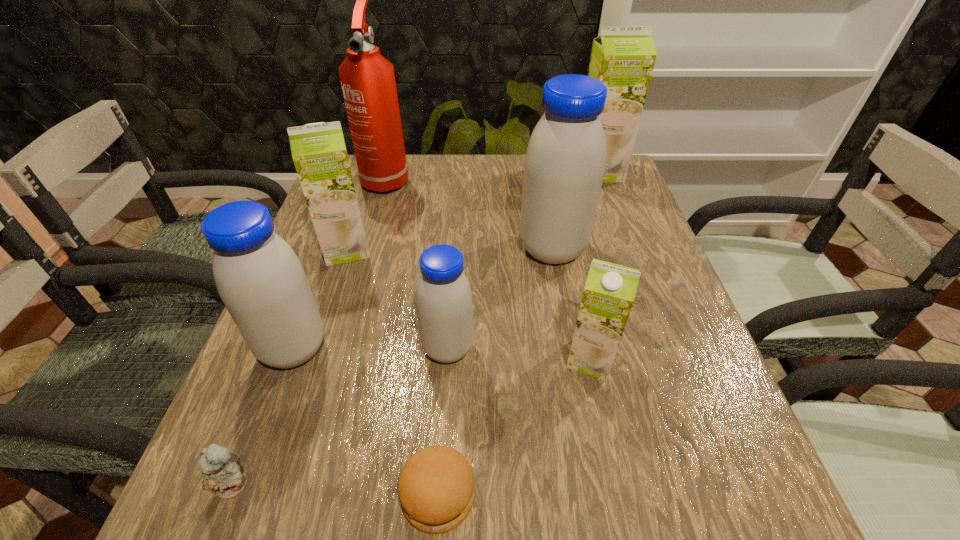
Locate an element on the screen. The image size is (960, 540). free space between the rightmost object and the red fire extinguisher is located at coordinates (492, 174).

What are the coordinates of `free space between the leftmost blue soya milk and the red fire extinguisher` in the screenshot? It's located at (340, 264).

Find the location of a particular element. This screenshot has width=960, height=540. free spot between the fire extinguisher and the rightmost blue soya milk is located at coordinates (469, 214).

Locate an element on the screen. This screenshot has width=960, height=540. free space between the brown hamburger and the smallest green soya milk is located at coordinates (515, 427).

Locate an element on the screen. The image size is (960, 540). free space between the blue teddy bear and the second blue soya milk from right to left is located at coordinates (341, 417).

Where is `vacant region between the leftmost green soya milk and the second blue soya milk from right to left`? The image size is (960, 540). vacant region between the leftmost green soya milk and the second blue soya milk from right to left is located at coordinates click(x=397, y=299).

Image resolution: width=960 pixels, height=540 pixels. In order to click on vacant point located between the second green soya milk from left to right and the red fire extinguisher in this screenshot , I will do (x=489, y=268).

Locate an element on the screen. The height and width of the screenshot is (540, 960). object that is the eighth nearest to the second smallest blue soya milk is located at coordinates click(622, 58).

Locate which object ranks seventh in proximity to the rightmost blue soya milk. Please provide its 2D coordinates. Your answer should be formatted as a tuple, i.e. [(x, y)], where the tuple contains the x and y coordinates of a point satisfying the conditions above.

[(436, 490)]

This screenshot has width=960, height=540. Find the location of `the fifth closest soya milk to the second green soya milk from right to left`. the fifth closest soya milk to the second green soya milk from right to left is located at coordinates (622, 58).